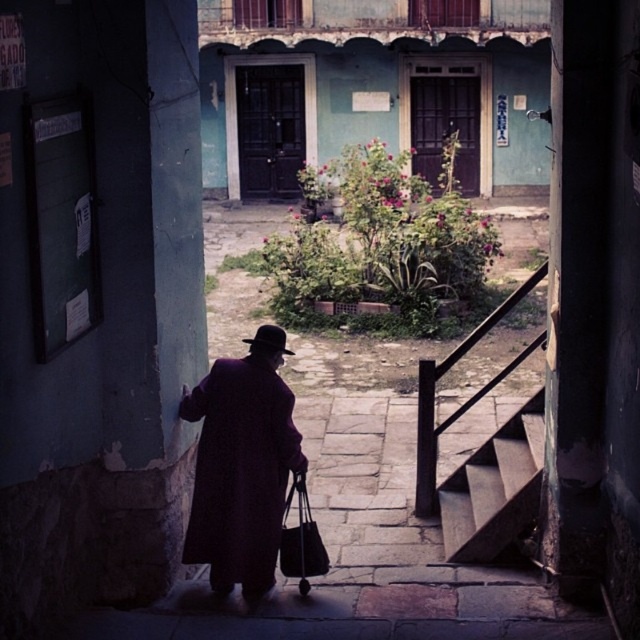
You are a delivery person who needs to place a package on the wooden stairs at center. The package is currently at the same level as the black leather bag at center. Do you need to move upward or downward to reach the stairs?

The wooden stairs at center is above the black leather bag at center, so you need to move upward to reach the stairs.

You are a photographer trying to capture the person in the scene. Since the purple matte coat at center and the black leather bag at center are both at the center, which one is closer to the camera?

The purple matte coat at center is positioned over the black leather bag at center, meaning it is closer to the camera.

You are standing in the historic urban setting and see the purple matte coat at center and the wooden stairs at center. Which object is nearer to you?

The purple matte coat at center is closer to the viewer than the wooden stairs at center.